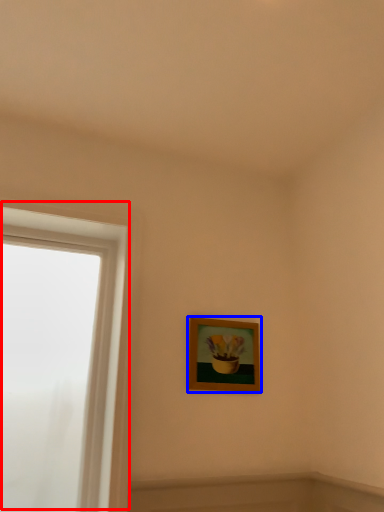
Question: Which point is further to the camera, window (highlighted by a red box) or picture frame (highlighted by a blue box)?

Choices:
 (A) window
 (B) picture frame

Answer: (B)